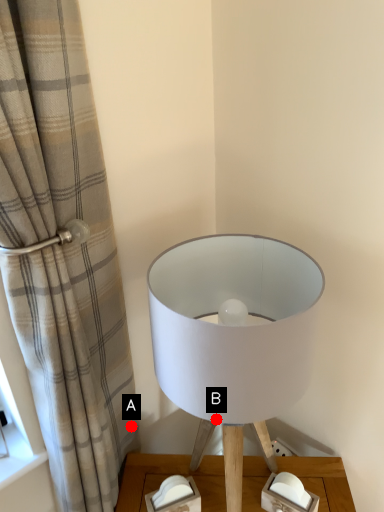
Question: Two points are circled on the image, labeled by A and B beside each circle. Which of the following is the closest to the observer?

Choices:
 (A) A is closer
 (B) B is closer

Answer: (B)